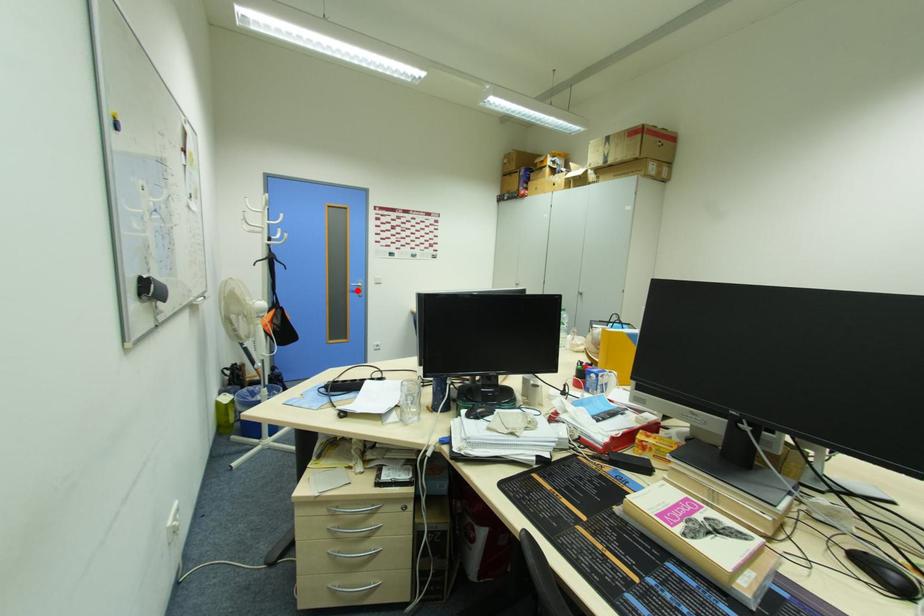
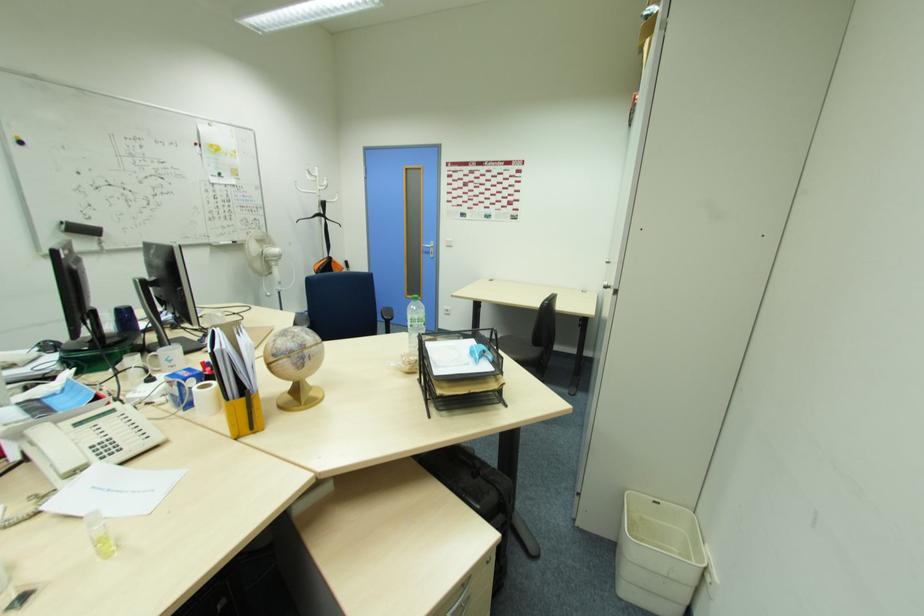
Question: I am providing you with two images of the same scene from different viewpoints. A red point is shown in image1. For the corresponding object point in image2, is it positioned nearer or farther from the camera?

Choices:
 (A) Nearer
 (B) Farther

Answer: (A)